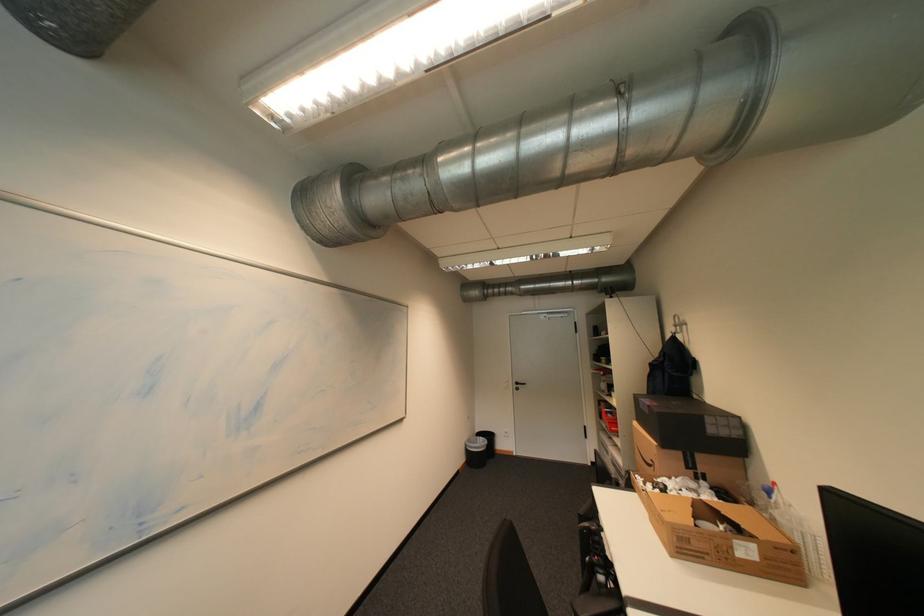
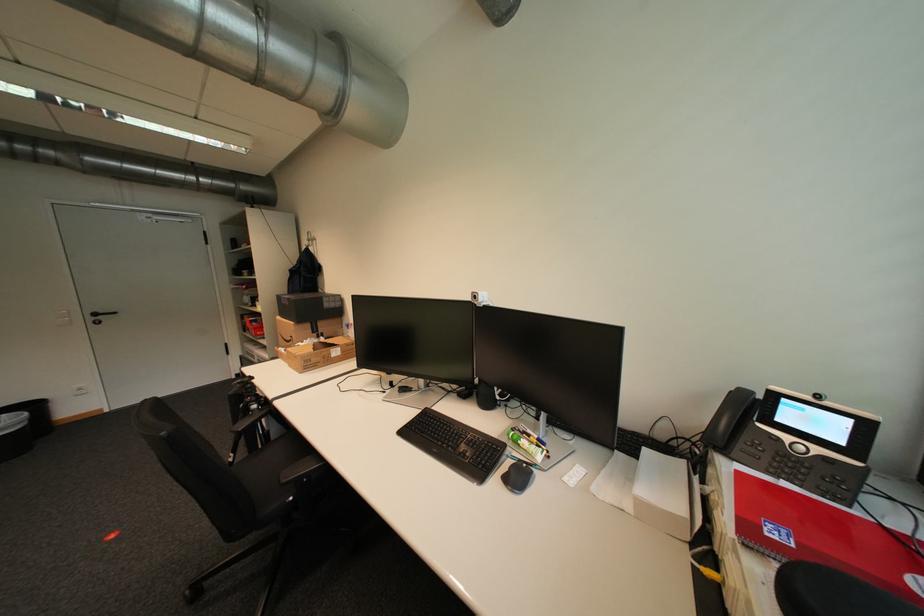
Find the pixel in the second image that matches the point at 599,464 in the first image.

(242, 378)